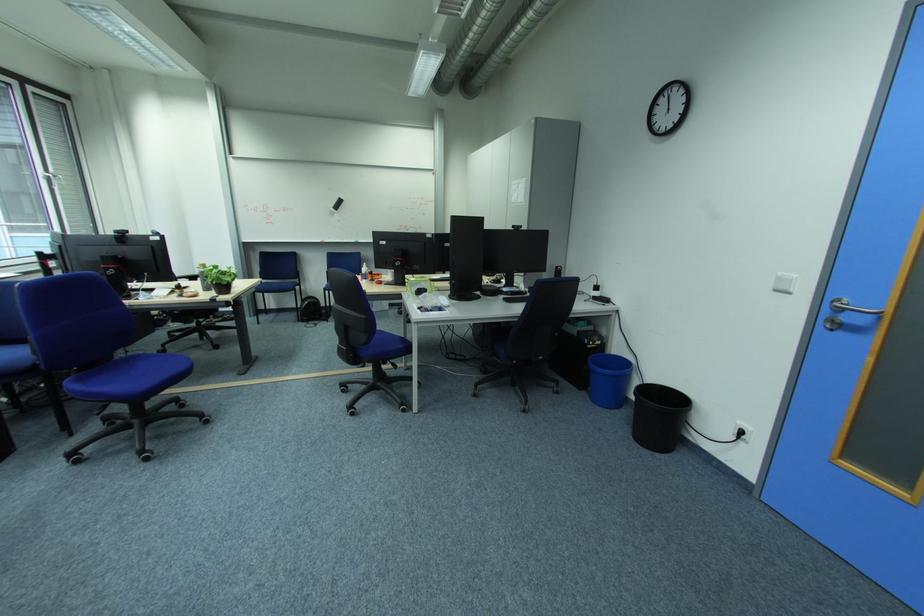
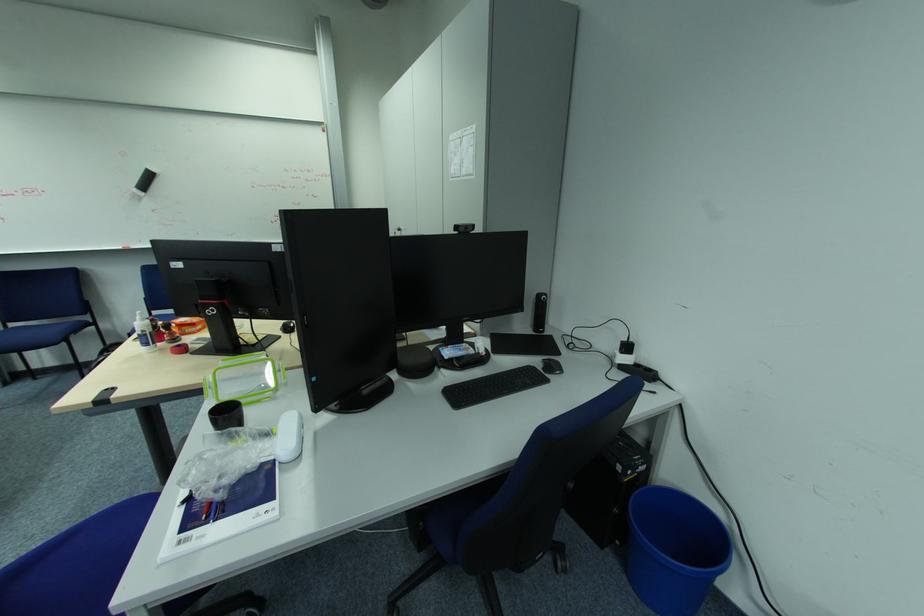
Question: The images are taken continuously from a first-person perspective. In which direction are you moving?

Choices:
 (A) Left
 (B) Right
 (C) Forward
 (D) Backward

Answer: (C)